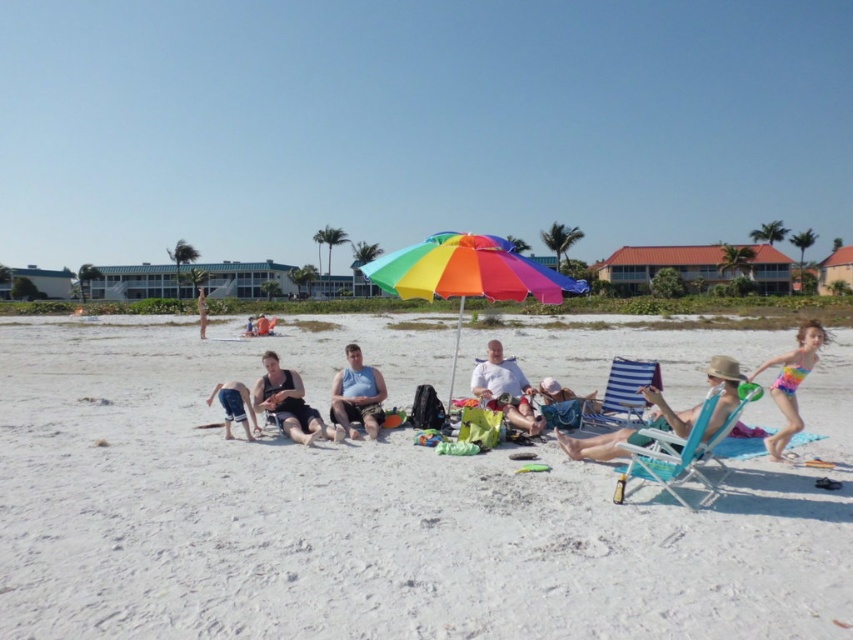
You are a lifeguard standing at the beach and you see a person wearing a matte blue tank top at center and another wearing matte black shorts at center. If you need to reach both individuals quickly, which one is closer to you?

The distance between the matte blue tank top at center and the matte black shorts at center is 20.16 meters, so neither is closer since they are the same distance from you.

What is the color of the clothing item located at the coordinates point [357,396]?

The clothing item at point [357,396] is a matte blue tank top.

You are a photographer trying to capture a closeup of the beige straw hat at center and the matte black shorts at center. Which object should you zoom in on to ensure both are in focus without moving the camera?

The beige straw hat at center occupies less space than matte black shorts at center, so you should zoom in on the matte black shorts at center to ensure both are in focus without moving the camera.